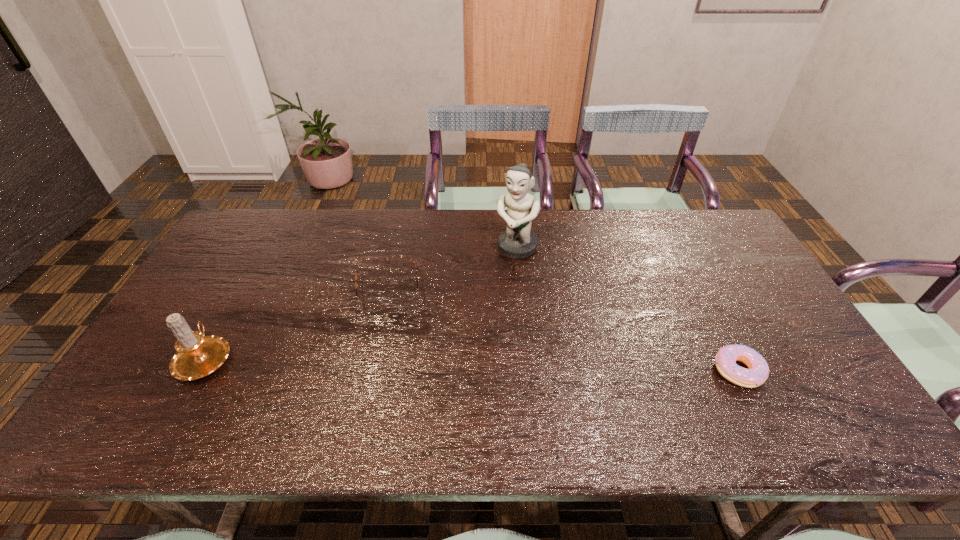
Locate an element on the screen. free space on the desktop that is between the third shortest object and the rightmost object and is positioned on the front-facing side of the figurine is located at coordinates (449, 364).

The image size is (960, 540). In order to click on free space on the desktop that is between the second tallest object and the shortest object and is positioned on the front-facing side of the spectacles in this screenshot , I will do `click(395, 362)`.